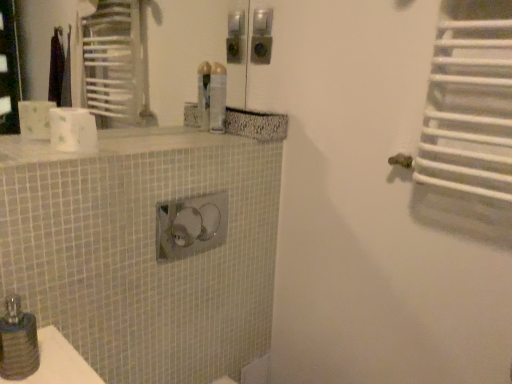
At what (x,y) coordinates should I click in order to perform the action: click on unoccupied area in front of translucent plastic spray can at upper center. Please return your answer as a coordinate pair (x, y). The image size is (512, 384). Looking at the image, I should click on (202, 134).